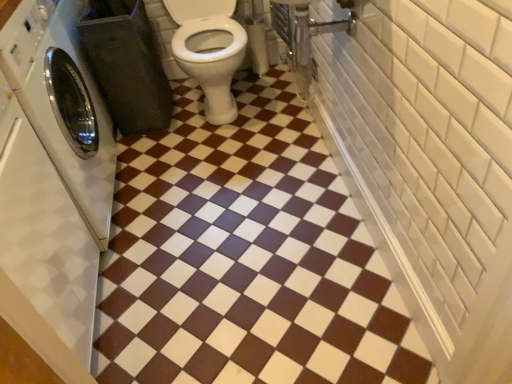
Find the location of `vacant region above brown glossy tile at center (from a real-world perspective)`. vacant region above brown glossy tile at center (from a real-world perspective) is located at coordinates (224, 208).